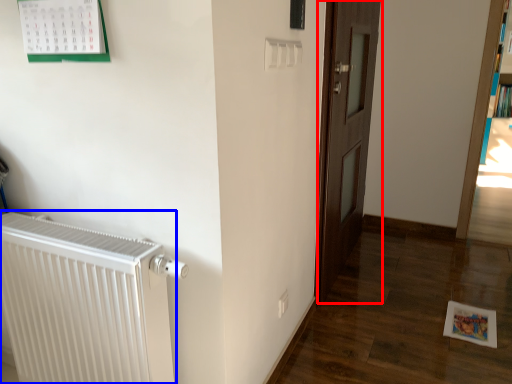
Question: Which object appears closest to the camera in this image, door (highlighted by a red box) or radiator (highlighted by a blue box)?

Choices:
 (A) door
 (B) radiator

Answer: (B)